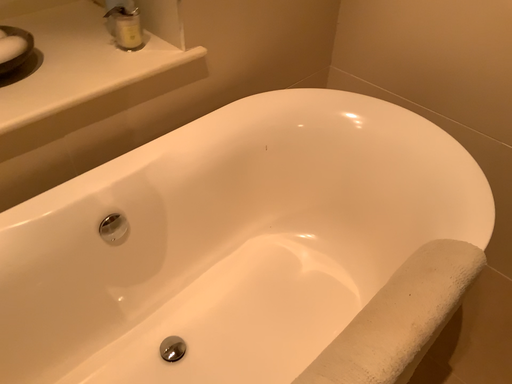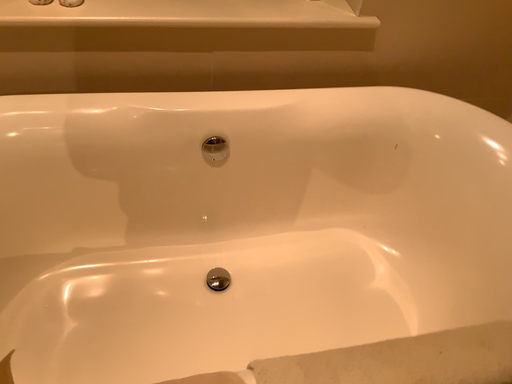
Question: Which way did the camera rotate in the video?

Choices:
 (A) rotated left
 (B) rotated right

Answer: (A)